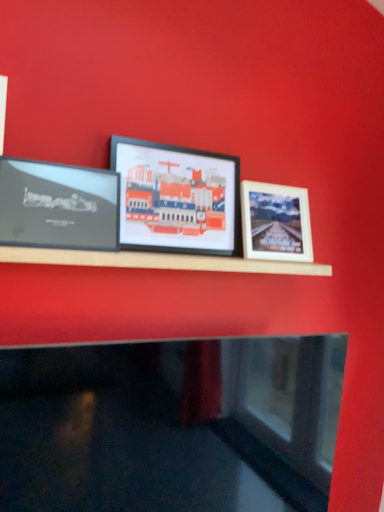
Question: Visually, is matte black frame at left, the third picture frame in the right-to-left sequence, positioned to the left or to the right of matte black picture frame at center, the second picture frame in the right-to-left sequence?

Choices:
 (A) left
 (B) right

Answer: (A)

Question: From the image's perspective, is matte black frame at left, acting as the first picture frame starting from the left, located above or below matte black picture frame at center, marked as the 2th picture frame in a left-to-right arrangement?

Choices:
 (A) below
 (B) above

Answer: (A)

Question: Considering the real-world distances, which object is farthest from the matte black frame at left, acting as the first picture frame starting from the left?

Choices:
 (A) matte black picture frame at center, the second picture frame in the right-to-left sequence
 (B) white matte picture frame at right, the 3th picture frame viewed from the left

Answer: (B)

Question: Estimate the real-world distances between objects in this image. Which object is farther from the matte black picture frame at center, marked as the 2th picture frame in a left-to-right arrangement?

Choices:
 (A) matte black frame at left, acting as the first picture frame starting from the left
 (B) white matte picture frame at right, which ranks as the 1th picture frame in right-to-left order

Answer: (A)